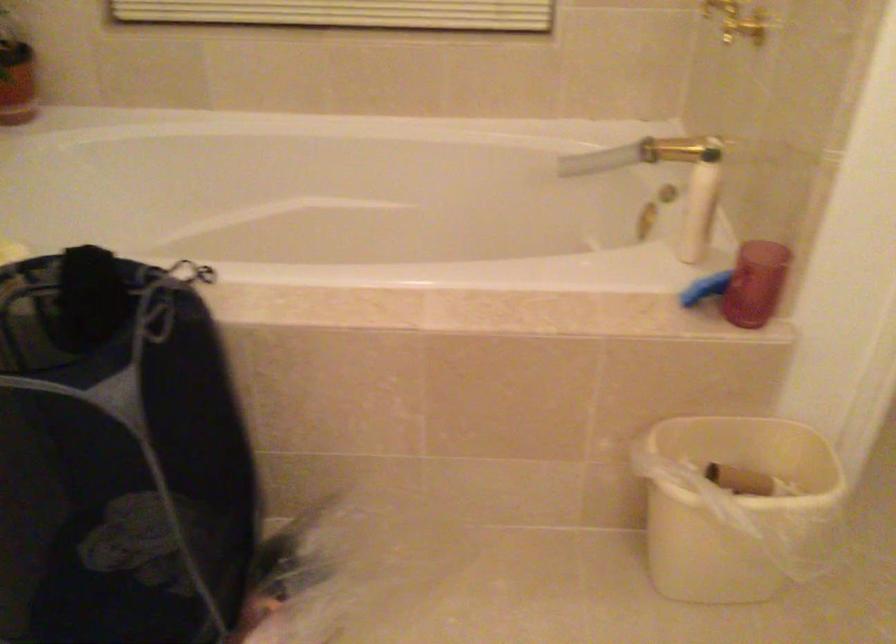
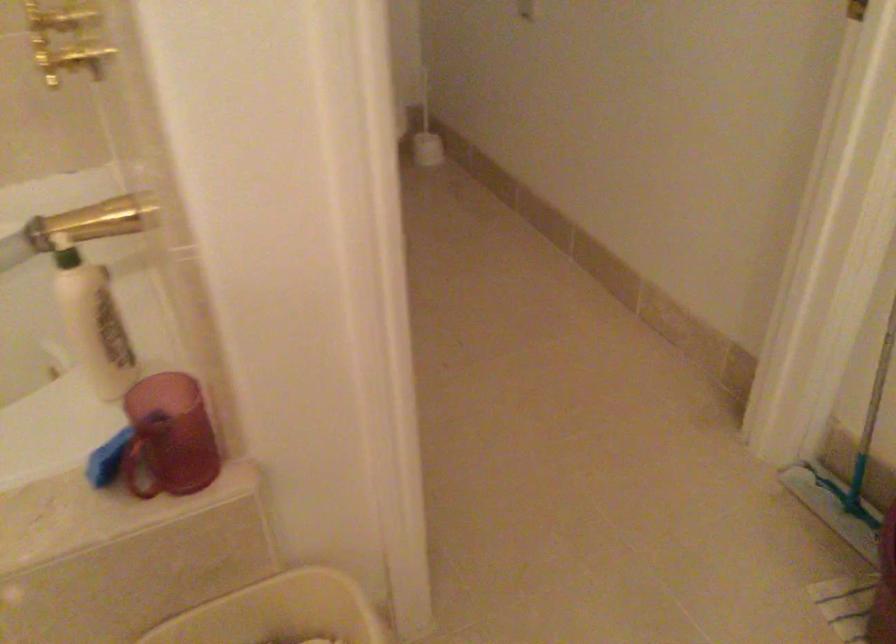
Find the pixel in the second image that matches (x=677, y=144) in the first image.

(95, 222)